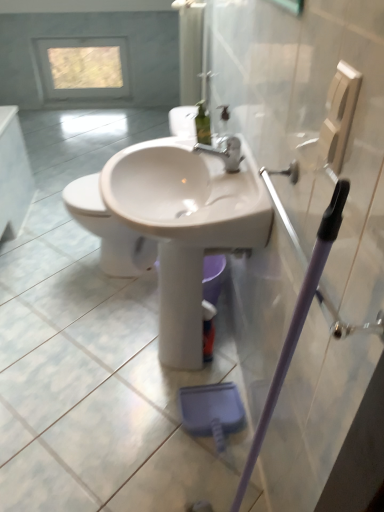
This screenshot has width=384, height=512. What do you see at coordinates (313, 124) in the screenshot?
I see `transparent plastic screen door at upper right` at bounding box center [313, 124].

Locate an element on the screen. The image size is (384, 512). transparent glass window at upper center is located at coordinates (84, 67).

Considering their positions, is white glossy sink at center located in front of or behind white glossy toilet at center?

Visually, white glossy sink at center is located in front of white glossy toilet at center.

Which is more to the right, white glossy sink at center or white glossy toilet at center?

A: Positioned to the right is white glossy sink at center.

Considering the relative sizes of white glossy sink at center and white glossy toilet at center in the image provided, is white glossy sink at center smaller than white glossy toilet at center?

Correct, white glossy sink at center occupies less space than white glossy toilet at center.

From the picture: From a real-world perspective, does white glossy sink at center sit lower than white glossy toilet at center?

Actually, white glossy sink at center is physically above white glossy toilet at center in the real world.

Can you confirm if transparent glass window at upper center is thinner than white glossy sink at center?

Yes, transparent glass window at upper center is thinner than white glossy sink at center.

What's the angular difference between transparent glass window at upper center and white glossy sink at center's facing directions?

The angular difference between transparent glass window at upper center and white glossy sink at center is 91.2 degrees.

How much distance is there between transparent glass window at upper center and white glossy sink at center?

transparent glass window at upper center is 10.03 feet away from white glossy sink at center.

Is the position of transparent glass window at upper center less distant than that of white glossy sink at center?

No, it is not.

Considering the sizes of objects transparent plastic screen door at upper right and white glossy toilet at center in the image provided, who is wider, transparent plastic screen door at upper right or white glossy toilet at center?

white glossy toilet at center is wider.

How different are the orientations of transparent plastic screen door at upper right and white glossy toilet at center in degrees?

There is a 14.7-degree angle between the facing directions of transparent plastic screen door at upper right and white glossy toilet at center.

Are transparent plastic screen door at upper right and white glossy toilet at center far apart?

transparent plastic screen door at upper right is positioned a significant distance from white glossy toilet at center.

Is transparent plastic screen door at upper right facing towards white glossy toilet at center?

No, transparent plastic screen door at upper right is not aimed at white glossy toilet at center.

Would you consider transparent glass window at upper center to be distant from white glossy toilet at center?

Yes.

Consider the image. From the image's perspective, does transparent glass window at upper center appear lower than white glossy toilet at center?

No, from the image's perspective, transparent glass window at upper center is not beneath white glossy toilet at center.

Can you confirm if transparent glass window at upper center is shorter than white glossy toilet at center?

Correct, transparent glass window at upper center is not as tall as white glossy toilet at center.

Is transparent glass window at upper center in front of or behind white glossy toilet at center in the image?

Visually, transparent glass window at upper center is located behind white glossy toilet at center.

In terms of width, does white glossy toilet at center look wider or thinner when compared to transparent glass window at upper center?

Clearly, white glossy toilet at center has more width compared to transparent glass window at upper center.

Between white glossy toilet at center and transparent glass window at upper center, which one has larger size?

With larger size is white glossy toilet at center.

Is white glossy toilet at center further to camera compared to transparent glass window at upper center?

No, it is not.

Considering the sizes of objects white glossy toilet at center and transparent glass window at upper center in the image provided, who is shorter, white glossy toilet at center or transparent glass window at upper center?

With less height is transparent glass window at upper center.

Is transparent plastic screen door at upper right aimed at white glossy sink at center?

No.

Does transparent plastic screen door at upper right appear on the right side of white glossy sink at center?

Yes, transparent plastic screen door at upper right is to the right of white glossy sink at center.

Which is closer to the camera, [270,290] or [177,322]?

Positioned in front is point [270,290].

From the picture: Could you measure the distance between transparent glass window at upper center and transparent plastic screen door at upper right?

The distance of transparent glass window at upper center from transparent plastic screen door at upper right is 3.26 meters.

From their relative heights in the image, would you say transparent glass window at upper center is taller or shorter than transparent plastic screen door at upper right?

In the image, transparent glass window at upper center appears to be shorter than transparent plastic screen door at upper right.

Are transparent glass window at upper center and transparent plastic screen door at upper right far apart?

Indeed, transparent glass window at upper center is not near transparent plastic screen door at upper right.

Consider the image. Between transparent glass window at upper center and transparent plastic screen door at upper right, which one appears on the right side from the viewer's perspective?

Positioned to the right is transparent plastic screen door at upper right.

At what (x,y) coordinates should I click in order to perform the action: click on sink in front of the white glossy toilet at center. Please return your answer as a coordinate pair (x, y). The height and width of the screenshot is (512, 384). Looking at the image, I should click on (186, 225).

Locate an element on the screen. This screenshot has height=512, width=384. window located on the left of white glossy sink at center is located at coordinates (84, 67).

Which object lies further to the anchor point white glossy toilet at center, white glossy sink at center or transparent glass window at upper center?

transparent glass window at upper center lies further to white glossy toilet at center than the other object.

Which object lies further to the anchor point transparent glass window at upper center, white glossy toilet at center or transparent plastic screen door at upper right?

The object further to transparent glass window at upper center is transparent plastic screen door at upper right.

Based on their spatial positions, is white glossy sink at center or white glossy toilet at center closer to transparent glass window at upper center?

white glossy toilet at center is closer to transparent glass window at upper center.

From the image, which object appears to be nearer to transparent glass window at upper center, white glossy sink at center or transparent plastic screen door at upper right?

Among the two, white glossy sink at center is located nearer to transparent glass window at upper center.

When comparing their distances from transparent plastic screen door at upper right, does white glossy toilet at center or transparent glass window at upper center seem further?

transparent glass window at upper center.

Considering their positions, is white glossy sink at center positioned further to transparent plastic screen door at upper right than white glossy toilet at center?

white glossy toilet at center is positioned further to the anchor transparent plastic screen door at upper right.

Estimate the real-world distances between objects in this image. Which object is further from white glossy toilet at center, transparent plastic screen door at upper right or transparent glass window at upper center?

The object further to white glossy toilet at center is transparent glass window at upper center.

When comparing their distances from white glossy sink at center, does transparent plastic screen door at upper right or white glossy toilet at center seem closer?

transparent plastic screen door at upper right is closer to white glossy sink at center.

You are a GUI agent. You are given a task and a screenshot of the screen. Output one action in this format:
    pyautogui.click(x=<x>, y=<y>)
    Task: Click on the sink between transparent plastic screen door at upper right and transparent glass window at upper center along the z-axis
    Image resolution: width=384 pixels, height=512 pixels.
    Given the screenshot: What is the action you would take?
    pyautogui.click(x=186, y=225)

Identify the location of toilet between white glossy sink at center and transparent glass window at upper center in the front-back direction. The height and width of the screenshot is (512, 384). (109, 230).

At what (x,y) coordinates should I click in order to perform the action: click on sink between transparent plastic screen door at upper right and white glossy toilet at center along the z-axis. Please return your answer as a coordinate pair (x, y). Image resolution: width=384 pixels, height=512 pixels. Looking at the image, I should click on (186, 225).

At what (x,y) coordinates should I click in order to perform the action: click on toilet located between transparent plastic screen door at upper right and transparent glass window at upper center in the depth direction. Please return your answer as a coordinate pair (x, y). Looking at the image, I should click on tap(109, 230).